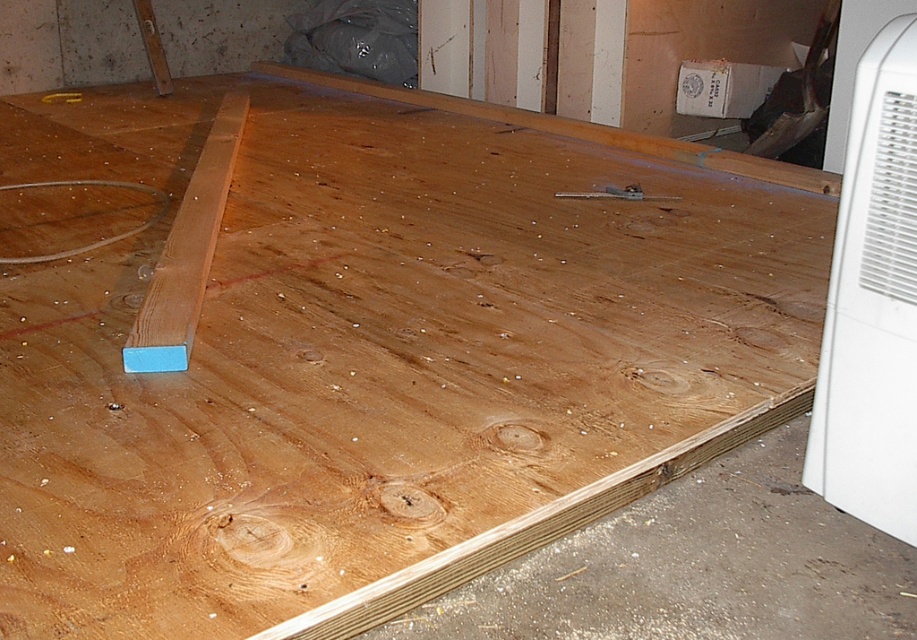
Question: In this image, where is white plastic air conditioner at right located relative to light brown wood plank at lower left?

Choices:
 (A) below
 (B) above

Answer: (A)

Question: Can you confirm if white plastic air conditioner at right is positioned above metallic silver tool at center?

Choices:
 (A) no
 (B) yes

Answer: (A)

Question: Among these objects, which one is nearest to the camera?

Choices:
 (A) blue plastic square at lower left
 (B) light brown wood plank at lower left
 (C) metallic silver tool at center

Answer: (B)

Question: Is light brown wood plank at lower left in front of metallic silver tool at center?

Choices:
 (A) no
 (B) yes

Answer: (B)

Question: Which point is farther from the camera taking this photo?

Choices:
 (A) (64, 93)
 (B) (142, 365)
 (C) (670, 198)

Answer: (A)

Question: Estimate the real-world distances between objects in this image. Which object is closer to the light brown wood plank at lower left?

Choices:
 (A) white plastic air conditioner at right
 (B) metallic silver tool at center

Answer: (B)